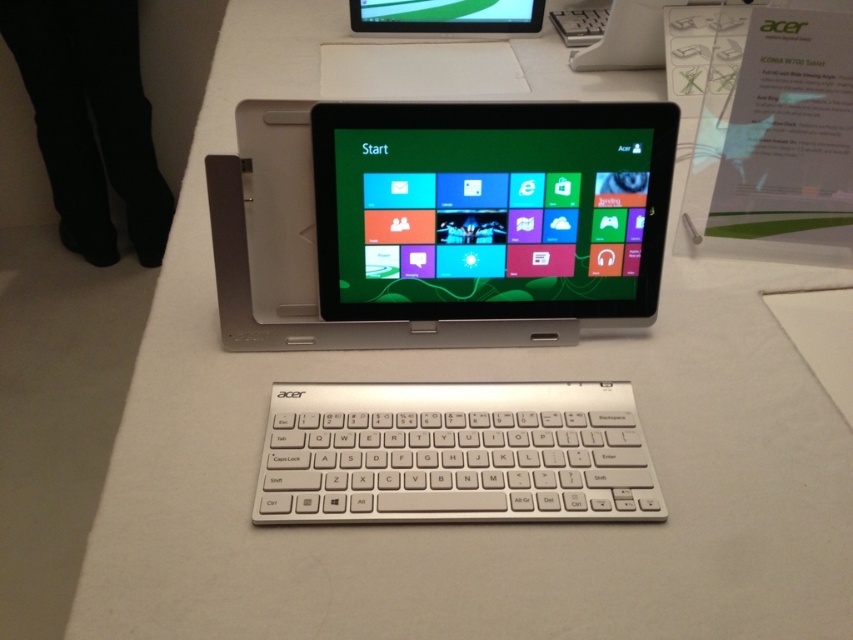
Does silver metallic tablet at center come behind white matte keyboard at center?

Yes, silver metallic tablet at center is further from the viewer.

Describe the element at coordinates (445, 221) in the screenshot. Image resolution: width=853 pixels, height=640 pixels. I see `silver metallic tablet at center` at that location.

Identify the location of silver metallic tablet at center. (445, 221).

Is matte plastic tablet at center wider than white matte keyboard at center?

No.

Is matte plastic tablet at center shorter than white matte keyboard at center?

No, matte plastic tablet at center is not shorter than white matte keyboard at center.

Which is behind, point (631, 170) or point (553, 428)?

Point (631, 170)

Where is `matte plastic tablet at center`? matte plastic tablet at center is located at coordinates point(489,218).

Is silver metallic tablet at center smaller than matte plastic tablet at center?

Incorrect, silver metallic tablet at center is not smaller in size than matte plastic tablet at center.

Describe the element at coordinates (445, 221) in the screenshot. The image size is (853, 640). I see `silver metallic tablet at center` at that location.

Find the location of `silver metallic tablet at center`. silver metallic tablet at center is located at coordinates (445, 221).

Where is `silver metallic tablet at center`? The width and height of the screenshot is (853, 640). silver metallic tablet at center is located at coordinates (445, 221).